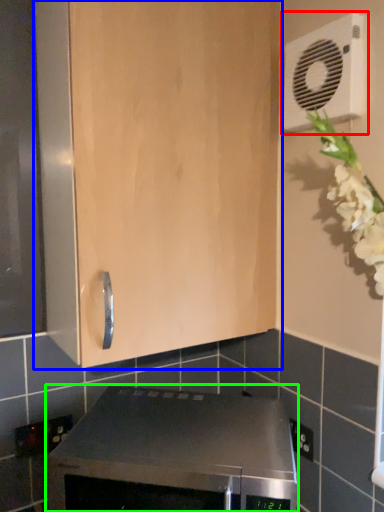
Question: Which is nearer to the air conditioning (highlighted by a red box)? cabinetry (highlighted by a blue box) or home appliance (highlighted by a green box).

Choices:
 (A) cabinetry
 (B) home appliance

Answer: (A)